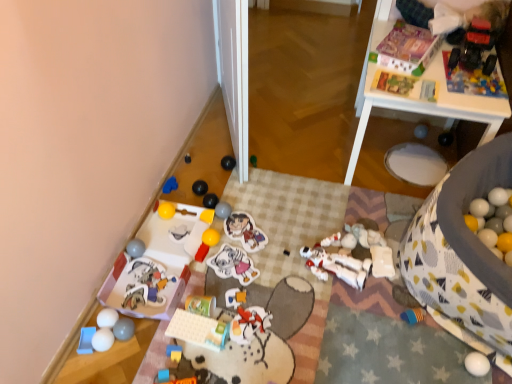
At what (x,y) coordinates should I click in order to perform the action: click on free location to the left of matte plastic sticker at center, the 20th toy when ordered from left to right. Please return your answer as a coordinate pair (x, y). The image size is (512, 384). Looking at the image, I should click on (206, 244).